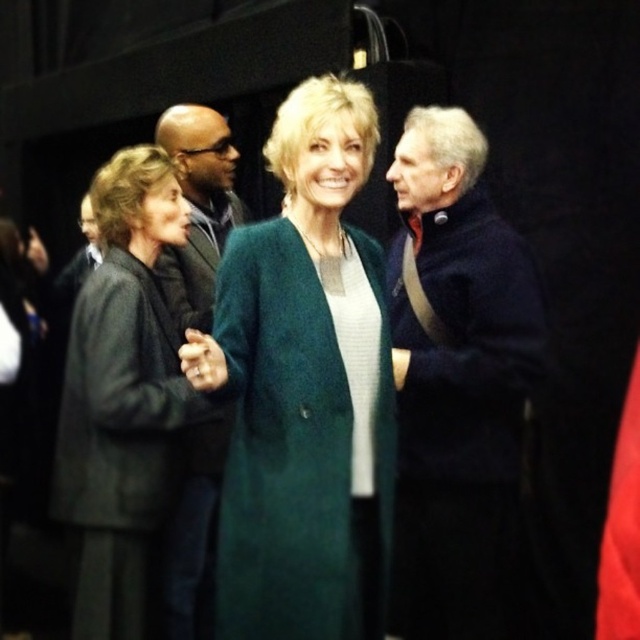
Is dark blue sweater at right taller than matte black coat at center?

Yes.

Can you confirm if dark blue sweater at right is thinner than matte black coat at center?

No, dark blue sweater at right is not thinner than matte black coat at center.

What are the coordinates of `dark blue sweater at right` in the screenshot? It's located at (456, 381).

Locate an element on the screen. This screenshot has height=640, width=640. dark blue sweater at right is located at coordinates (456, 381).

Is dark blue sweater at right to the left of dark gray wool coat at left from the viewer's perspective?

Incorrect, dark blue sweater at right is not on the left side of dark gray wool coat at left.

Between dark blue sweater at right and dark gray wool coat at left, which one has less height?

Standing shorter between the two is dark gray wool coat at left.

At what (x,y) coordinates should I click in order to perform the action: click on dark blue sweater at right. Please return your answer as a coordinate pair (x, y). The width and height of the screenshot is (640, 640). Looking at the image, I should click on (x=456, y=381).

Can you confirm if green wool coat at center is taller than dark blue sweater at right?

Incorrect, green wool coat at center's height is not larger of dark blue sweater at right's.

Is green wool coat at center positioned in front of dark blue sweater at right?

Yes, it is.

In order to click on green wool coat at center in this screenshot , I will do `click(305, 387)`.

Identify the location of green wool coat at center. The image size is (640, 640). (305, 387).